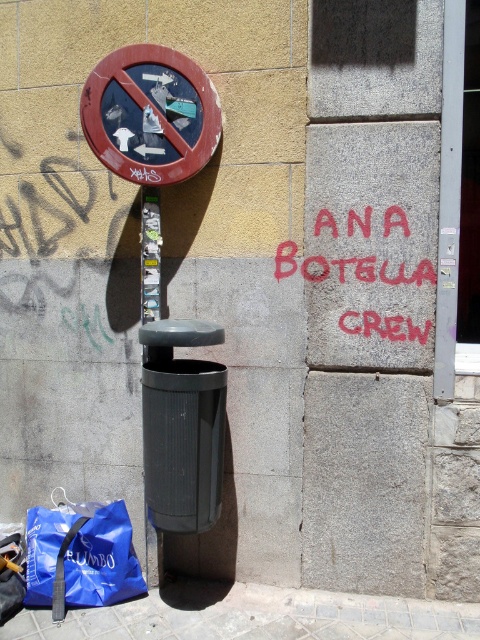
You are standing in front of the wall with the circular red sign and the graffiti. You notice two points marked on the wall. The first point is at coordinates point (120, 500) and the second is at point (432, 282). If you were to walk towards the wall, which point would you encounter first?

Point (432, 282) would be encountered first because it is closer to the observer than point (120, 500), which is positioned behind it.

You are standing in front of the wall described. You need to place a blue fabric bag at lower left. Where should you place it so it is not in front of the red painted circular sign at upper left?

The blue fabric bag at lower left should be placed behind the red painted circular sign at upper left since the sign is closer to the viewer, ensuring the bag is not in front of it.

What is located at the point with coordinates (x=252, y=616) in the image?

The gray concrete pavement at lower center is located at the point with coordinates (x=252, y=616).